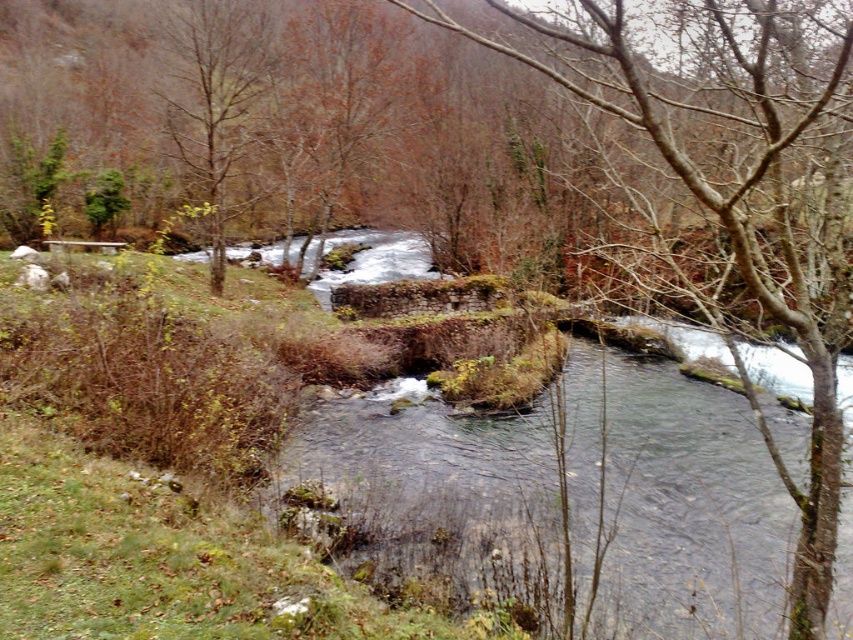
Question: Which is nearer to the brown leafless tree at upper left?

Choices:
 (A) bare branches at center
 (B) brown leafy tree at upper center

Answer: (B)

Question: Can you confirm if bare branches at center is positioned above brown leafy tree at upper center?

Choices:
 (A) yes
 (B) no

Answer: (B)

Question: Does bare branches at center have a smaller size compared to brown leafy tree at upper center?

Choices:
 (A) yes
 (B) no

Answer: (B)

Question: Does bare branches at center have a greater width compared to brown leafy tree at upper center?

Choices:
 (A) no
 (B) yes

Answer: (B)

Question: Which object is the farthest from the brown leafy tree at upper center?

Choices:
 (A) brown leafless tree at upper left
 (B) bare branches at center

Answer: (B)

Question: Which point is closer to the camera taking this photo?

Choices:
 (A) (273, 125)
 (B) (672, 196)

Answer: (B)